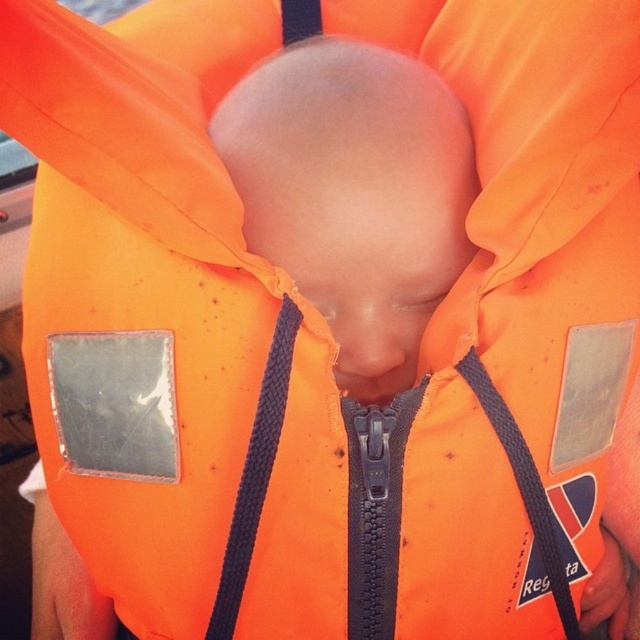
Which of these two, smooth skin head at center or black fabric strap at center, stands shorter?

Standing shorter between the two is black fabric strap at center.

Is smooth skin head at center positioned in front of black fabric strap at center?

No, smooth skin head at center is behind black fabric strap at center.

Is point (228, 161) positioned behind point (468, 358)?

That is True.

The height and width of the screenshot is (640, 640). Identify the location of smooth skin head at center. (355, 195).

Between point (372, 289) and point (237, 566), which one is positioned in front?

Point (237, 566) is more forward.

Which is behind, point (336, 140) or point (234, 589)?

Positioned behind is point (234, 589).

This screenshot has height=640, width=640. Find the location of `smooth skin head at center`. smooth skin head at center is located at coordinates (355, 195).

Is black braided strap at center below black fabric strap at center?

No, black braided strap at center is not below black fabric strap at center.

This screenshot has width=640, height=640. What do you see at coordinates (256, 472) in the screenshot?
I see `black braided strap at center` at bounding box center [256, 472].

The height and width of the screenshot is (640, 640). I want to click on black braided strap at center, so click(x=256, y=472).

The width and height of the screenshot is (640, 640). Find the location of `black braided strap at center`. black braided strap at center is located at coordinates (256, 472).